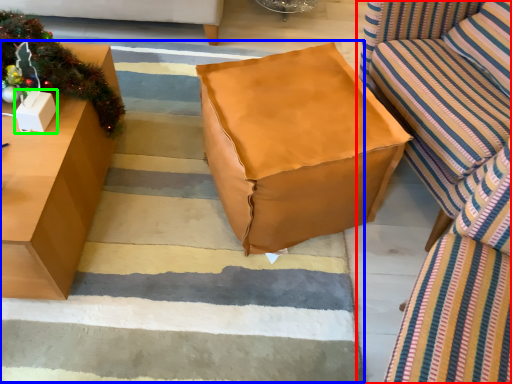
Question: Estimate the real-world distances between objects in this image. Which object is closer to studio couch (highlighted by a red box), stair (highlighted by a blue box) or cardboard box (highlighted by a green box)?

Choices:
 (A) stair
 (B) cardboard box

Answer: (A)